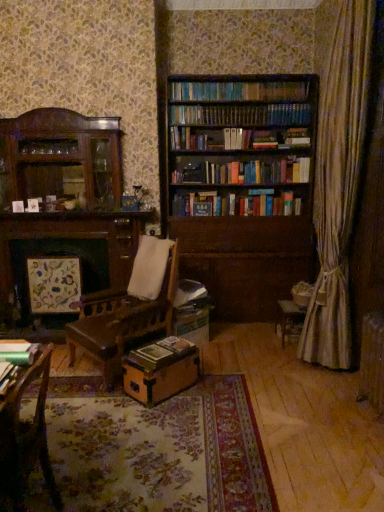
Question: Considering the positions of point (19, 345) and point (137, 372), is point (19, 345) closer or farther from the camera than point (137, 372)?

Choices:
 (A) farther
 (B) closer

Answer: (B)

Question: Considering the positions of metallic green book at lower left, placed as the second book when sorted from back to front, and brown cardboard box at center in the image, is metallic green book at lower left, placed as the second book when sorted from back to front, wider or thinner than brown cardboard box at center?

Choices:
 (A) thin
 (B) wide

Answer: (A)

Question: Estimate the real-world distances between objects in this image. Which object is farther from the hardcover book at center, which is counted as the first book, starting from the right?

Choices:
 (A) brown cardboard box at center
 (B) brown wooden bookcase at center
 (C) wooden chair at lower left
 (D) metallic green book at lower left, the first book positioned from the front

Answer: (B)

Question: Which object is positioned closest to the metallic green book at lower left, the 2th book from the right?

Choices:
 (A) brown wooden bookcase at center
 (B) hardcover book at center, which appears as the first book when ordered from the bottom
 (C) wooden chair at lower left
 (D) brown cardboard box at center

Answer: (C)